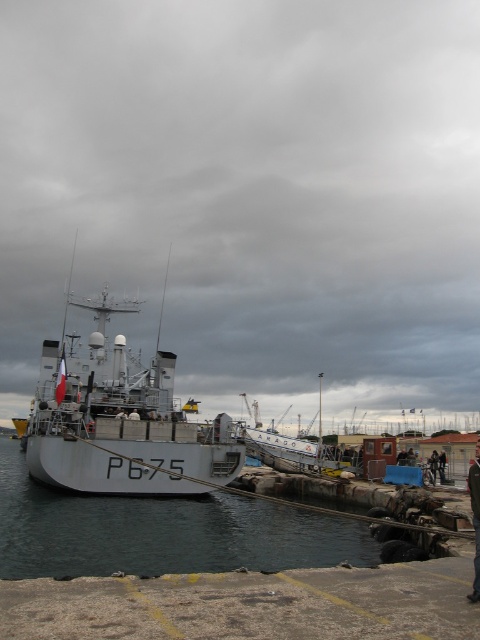
Does metallic gray ship at center appear under white matte ship at center?

No.

Who is shorter, metallic gray ship at center or white matte ship at center?

Standing shorter between the two is white matte ship at center.

Is point (253, 349) positioned in front of point (166, 368)?

No, (253, 349) is further to viewer.

Where is `metallic gray ship at center`? metallic gray ship at center is located at coordinates (250, 195).

Is point (163, 516) behind point (472, 600)?

Yes, point (163, 516) is farther from viewer.

Can you confirm if gray matte water at center is positioned to the right of dark blue uniform at center?

No, gray matte water at center is not to the right of dark blue uniform at center.

Between point (32, 552) and point (475, 582), which one is positioned in front?

Point (475, 582)

Identify the location of gray matte water at center. (159, 531).

Does gray matte water at center appear on the right side of white matte ship at center?

Yes, gray matte water at center is to the right of white matte ship at center.

What do you see at coordinates (159, 531) in the screenshot? The image size is (480, 640). I see `gray matte water at center` at bounding box center [159, 531].

Is point (146, 502) farther from camera compared to point (121, 467)?

That is True.

Identify the location of gray matte water at center. (159, 531).